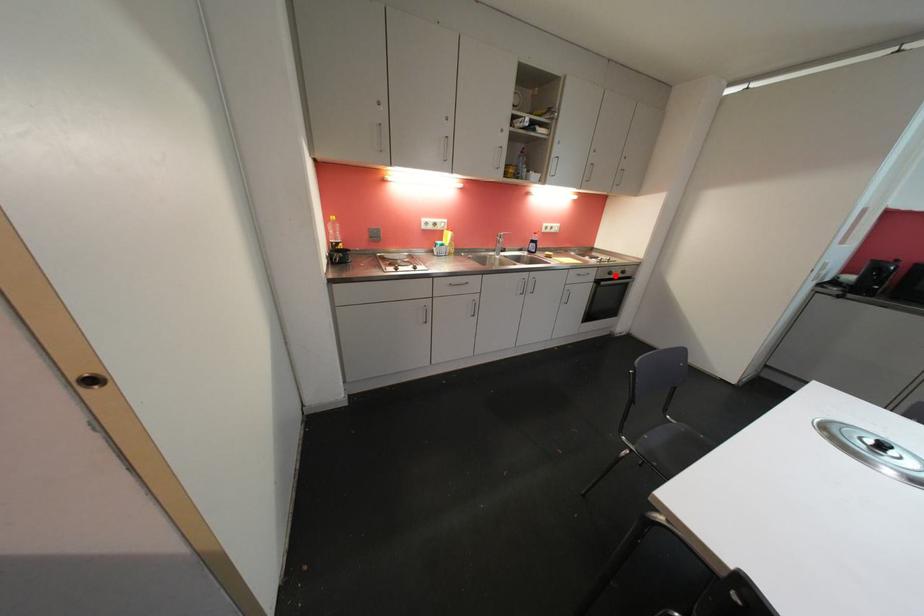
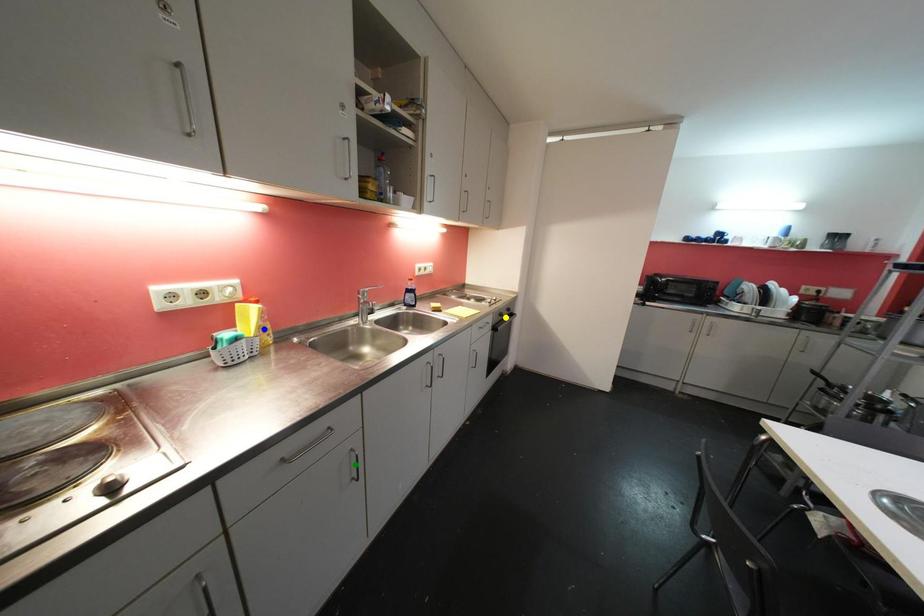
Question: I am providing you with two images of the same scene from different viewpoints. A red point is marked on the first image. You are given multiple points on the second image. Which mark in image 2 goes with the point in image 1?

Choices:
 (A) green point
 (B) blue point
 (C) yellow point

Answer: (C)